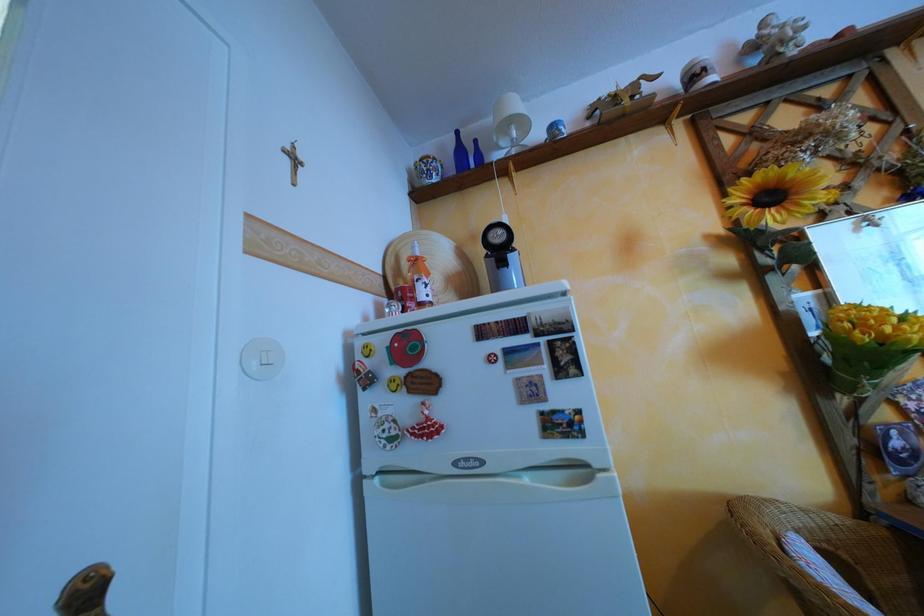
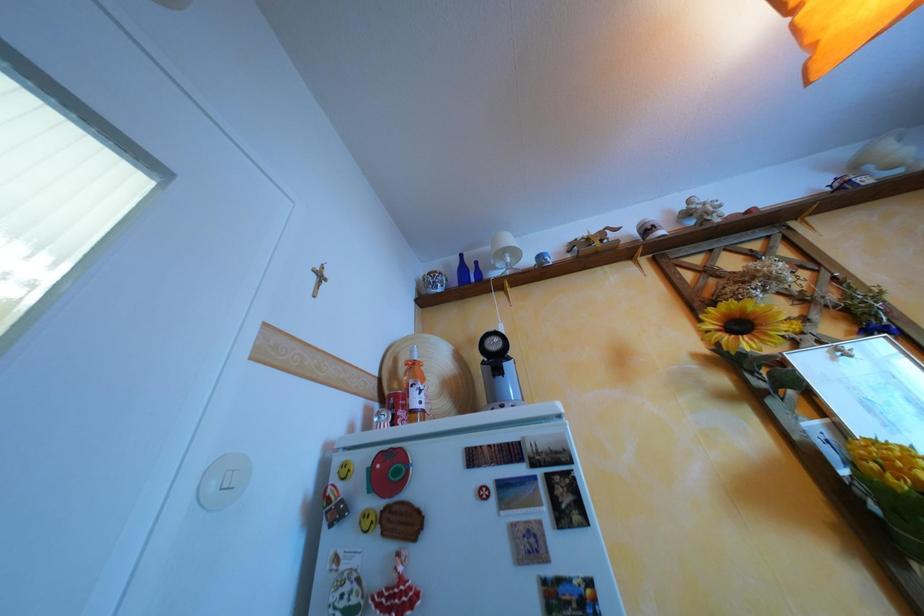
Question: Based on the continuous images, in which direction is the camera rotating? Reply with the corresponding letter.

Choices:
 (A) Left
 (B) Right
 (C) Up
 (D) Down

Answer: (C)